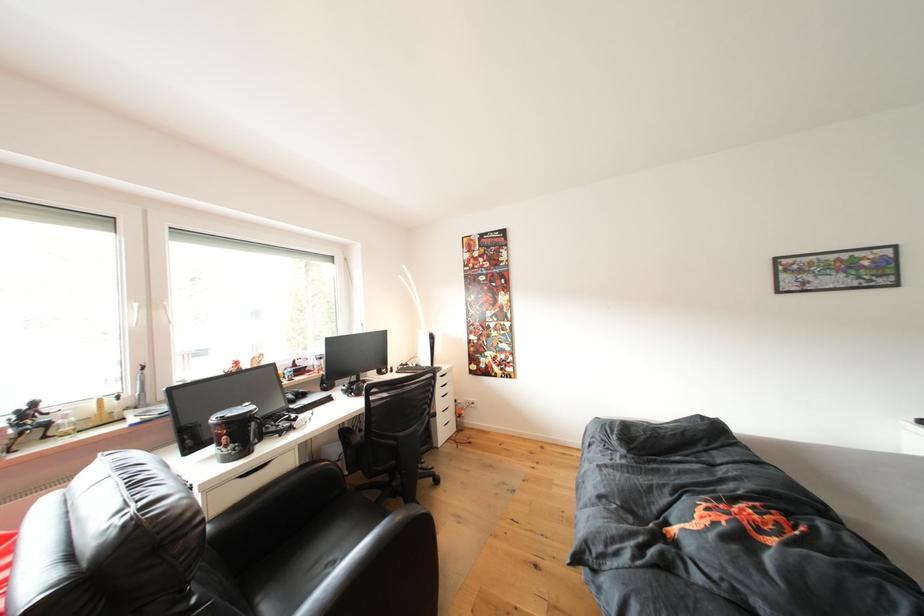
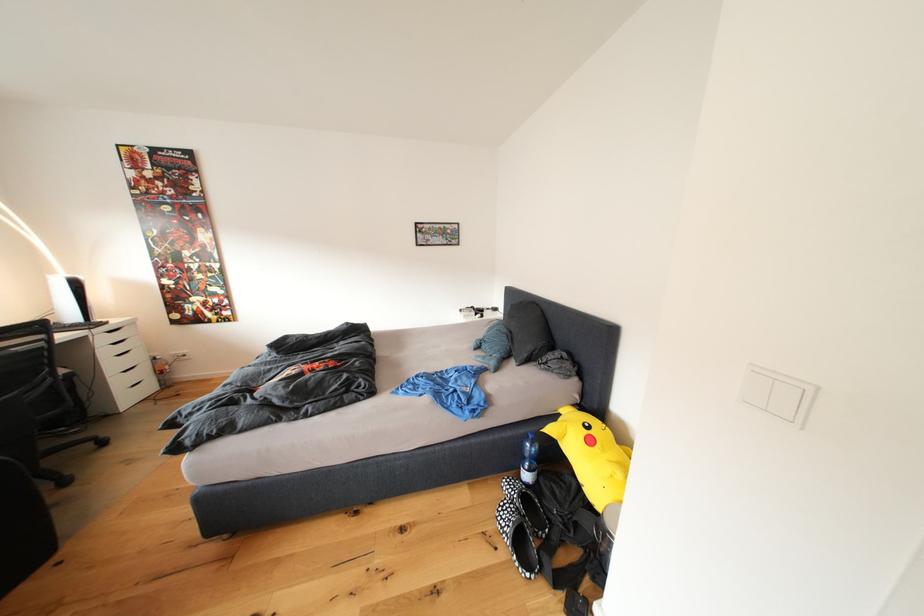
Where in the second image is the point corresponding to [447,387] from the first image?

(111, 344)